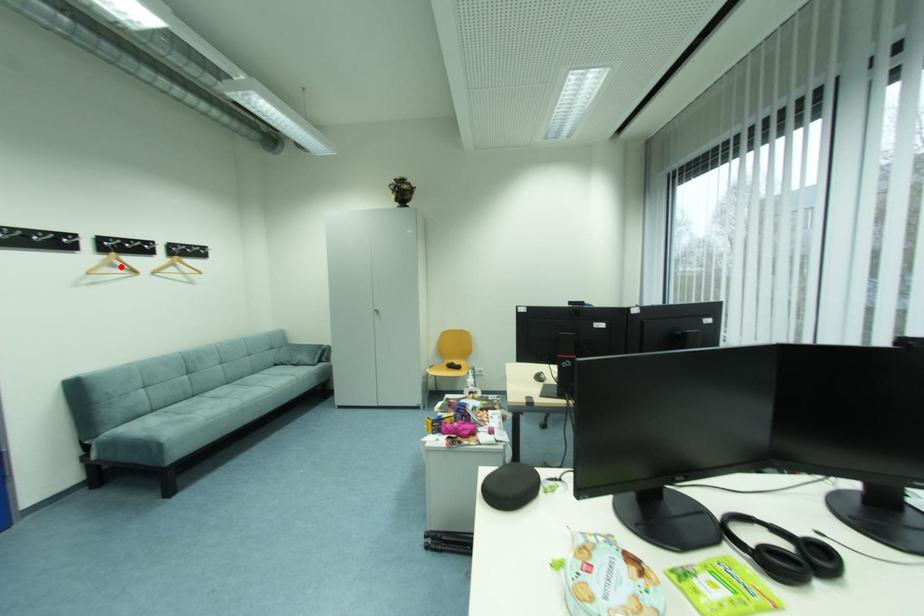
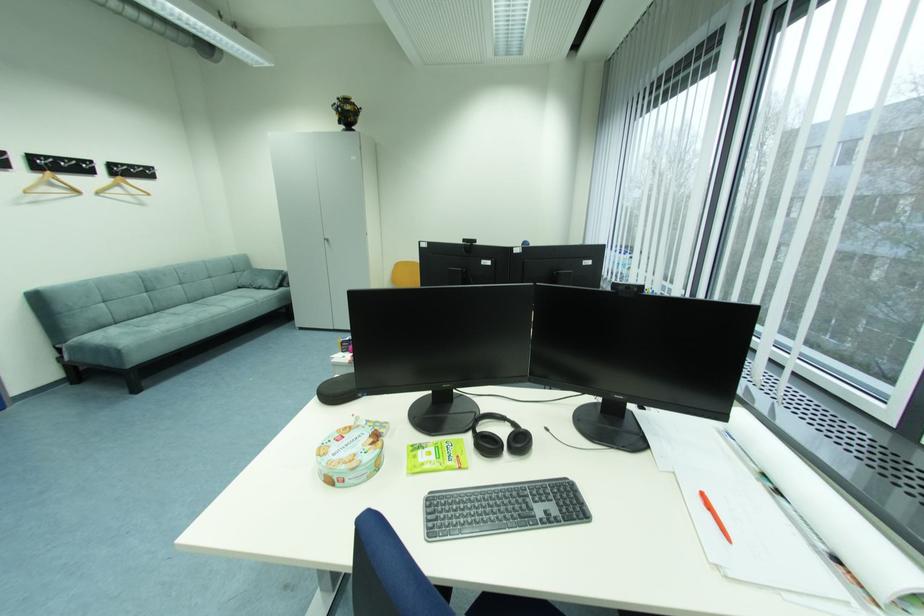
Find the pixel in the second image that matches the highlighted location in the first image.

(59, 185)